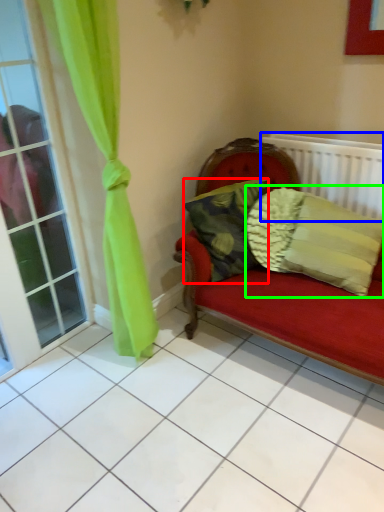
Question: Estimate the real-world distances between objects in this image. Which object is closer to pillow (highlighted by a red box), radiator (highlighted by a blue box) or pillow (highlighted by a green box)?

Choices:
 (A) radiator
 (B) pillow

Answer: (B)